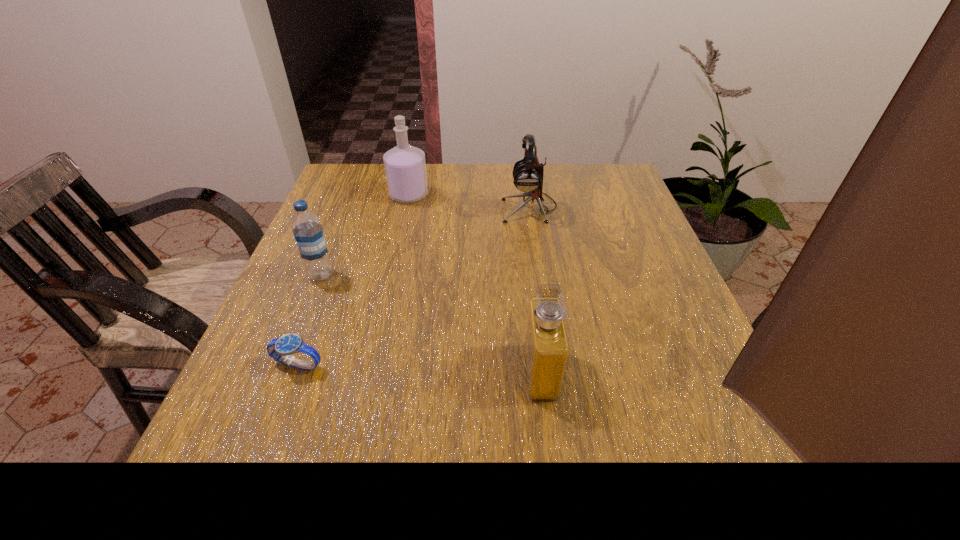
The image size is (960, 540). What are the coordinates of `free space between the watch and the nearer perfume` in the screenshot? It's located at (420, 368).

Identify the location of unoccupied area between the nearer perfume and the water bottle. (431, 323).

Identify the location of vacant area between the right perfume and the water bottle. (431, 323).

Locate an element on the screen. Image resolution: width=960 pixels, height=540 pixels. empty space that is in between the third nearest object and the third object from right to left is located at coordinates (365, 235).

Find the location of a particular element. This screenshot has width=960, height=540. free space between the earphone and the water bottle is located at coordinates (425, 241).

Select which object is the second closest to the shorter perfume. Please provide its 2D coordinates. Your answer should be formatted as a tuple, i.e. [(x, y)], where the tuple contains the x and y coordinates of a point satisfying the conditions above.

[(528, 173)]

Identify which object is the fourth nearest to the watch. Please provide its 2D coordinates. Your answer should be formatted as a tuple, i.e. [(x, y)], where the tuple contains the x and y coordinates of a point satisfying the conditions above.

[(528, 173)]

The width and height of the screenshot is (960, 540). Find the location of `vacant space that satisfies the following two spatial constraints: 1. on the label of the third farthest object; 2. on the left side of the shortest object`. vacant space that satisfies the following two spatial constraints: 1. on the label of the third farthest object; 2. on the left side of the shortest object is located at coordinates (286, 364).

Image resolution: width=960 pixels, height=540 pixels. Find the location of `blank space that satisfies the following two spatial constraints: 1. on the label of the third farthest object; 2. on the left side of the watch`. blank space that satisfies the following two spatial constraints: 1. on the label of the third farthest object; 2. on the left side of the watch is located at coordinates (286, 364).

Identify the location of free point that satisfies the following two spatial constraints: 1. on the back side of the watch; 2. on the right side of the earphone. (357, 207).